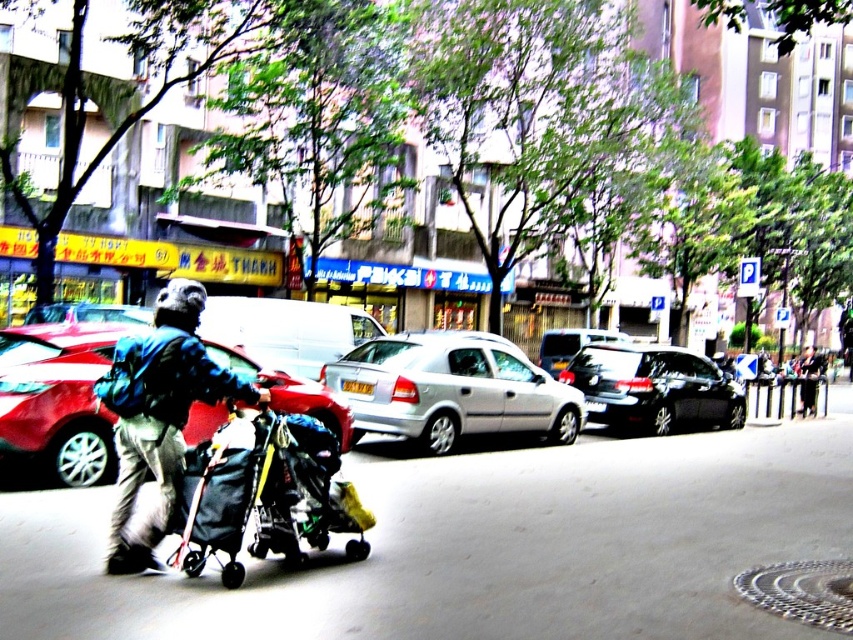
Question: Which object is positioned closest to the dark blue backpack at left?

Choices:
 (A) dark gray fabric stroller at center-left
 (B) shiny black sedan at center
 (C) silver metallic hatchback at center

Answer: (A)

Question: Based on their relative distances, which object is farther from the shiny black sedan at center?

Choices:
 (A) metallic silver car at center
 (B) dark blue backpack at left

Answer: (B)

Question: Does dark gray fabric stroller at center-left have a larger size compared to dark blue backpack at left?

Choices:
 (A) no
 (B) yes

Answer: (B)

Question: Does metallic silver car at center have a lesser width compared to silver metallic hatchback at center?

Choices:
 (A) yes
 (B) no

Answer: (B)

Question: Which object is closer to the camera taking this photo?

Choices:
 (A) dark blue backpack at left
 (B) dark gray fabric stroller at center-left
 (C) silver metallic hatchback at center

Answer: (B)

Question: Is dark gray fabric stroller at center-left bigger than metallic silver car at center?

Choices:
 (A) yes
 (B) no

Answer: (B)